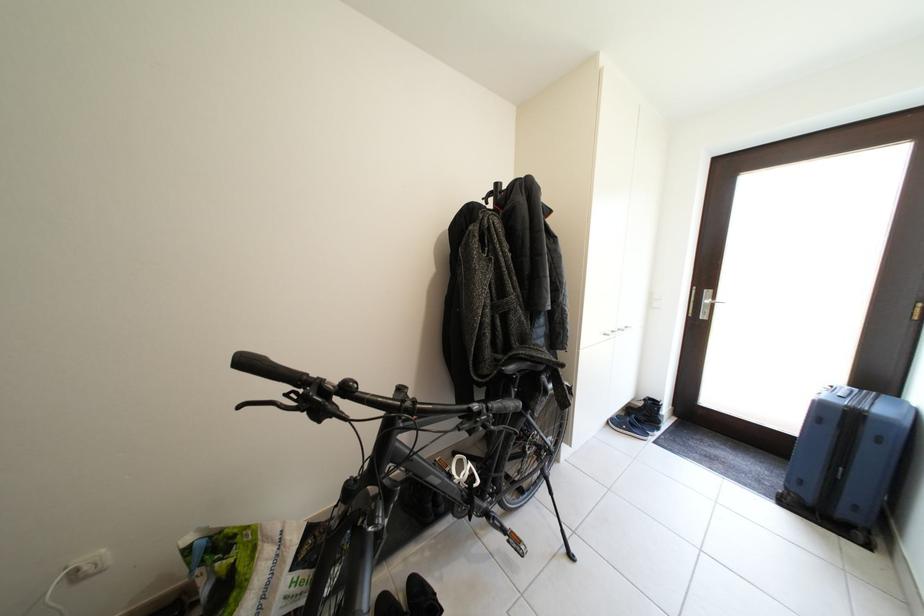
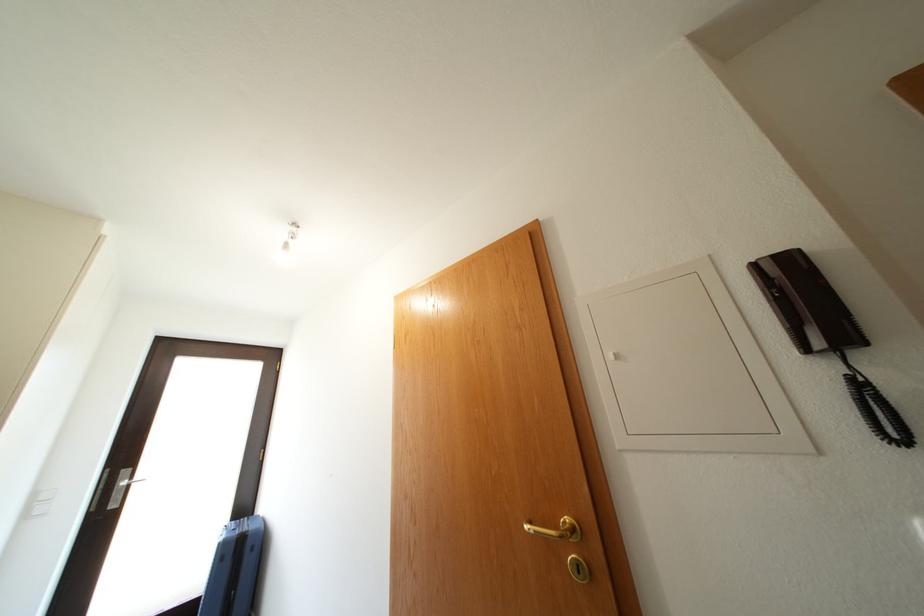
How did the camera likely rotate?

The camera's rotation is toward right-up.